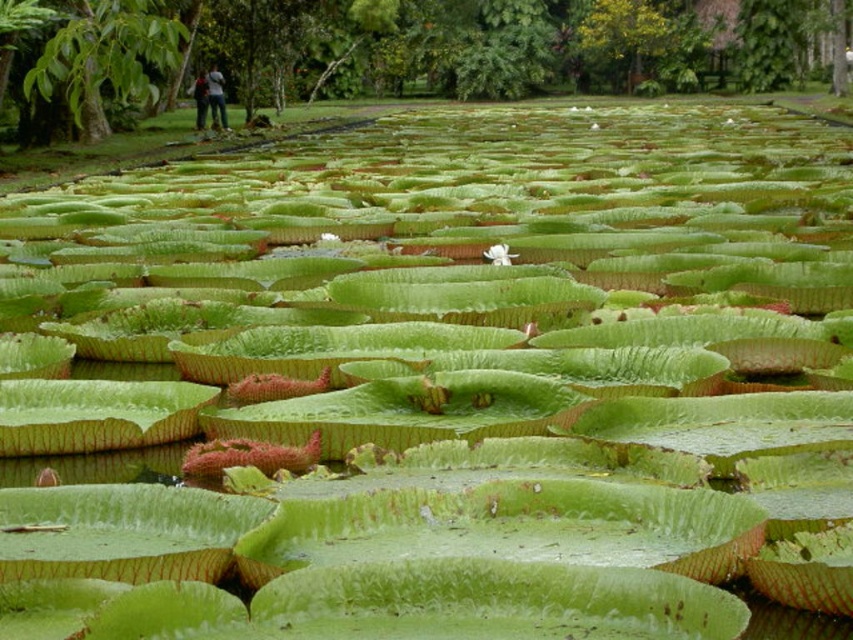
Question: Which point is closer to the camera?

Choices:
 (A) denim jacket at upper left
 (B) dark blue jeans at upper left
 (C) white matte flower at center

Answer: (C)

Question: Where is denim jacket at upper left located in relation to white matte flower at center in the image?

Choices:
 (A) below
 (B) above

Answer: (B)

Question: Among these objects, which one is farthest from the camera?

Choices:
 (A) denim jacket at upper left
 (B) white matte flower at center

Answer: (A)

Question: Is dark blue jeans at upper left behind white matte flower at center?

Choices:
 (A) no
 (B) yes

Answer: (B)

Question: Which object appears closest to the camera in this image?

Choices:
 (A) denim jacket at upper left
 (B) dark blue jeans at upper left
 (C) white matte flower at center

Answer: (C)

Question: Is denim jacket at upper left closer to the viewer compared to dark blue jeans at upper left?

Choices:
 (A) no
 (B) yes

Answer: (A)